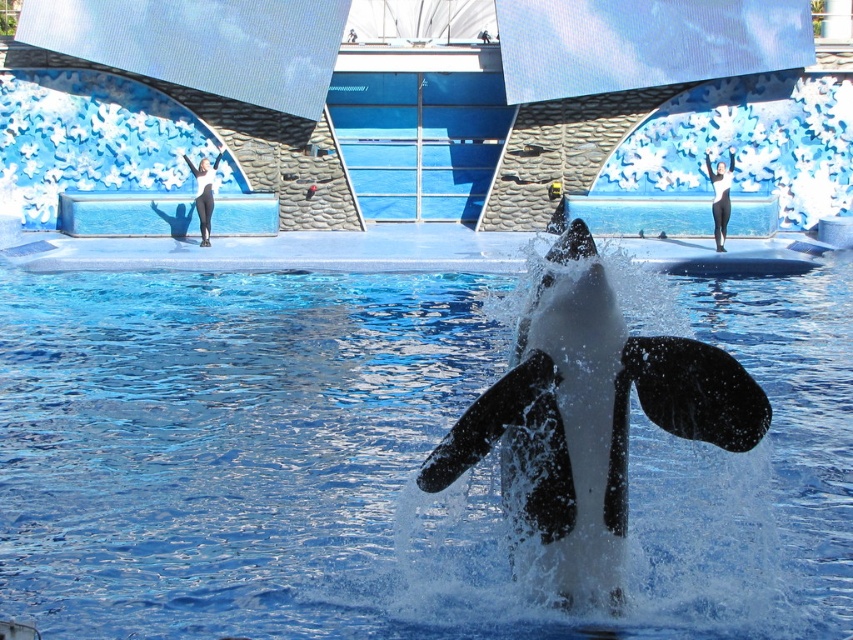
Question: Which of the following is the farthest from the observer?

Choices:
 (A) clear blue water at center
 (B) black smooth whale at center

Answer: (A)

Question: Which of the following is the closest to the observer?

Choices:
 (A) black smooth whale at center
 (B) clear blue water at center

Answer: (A)

Question: Is the position of clear blue water at center less distant than that of black smooth whale at center?

Choices:
 (A) yes
 (B) no

Answer: (B)

Question: Is clear blue water at center bigger than black smooth whale at center?

Choices:
 (A) yes
 (B) no

Answer: (A)

Question: Considering the relative positions of clear blue water at center and black smooth whale at center in the image provided, where is clear blue water at center located with respect to black smooth whale at center?

Choices:
 (A) below
 (B) above

Answer: (B)